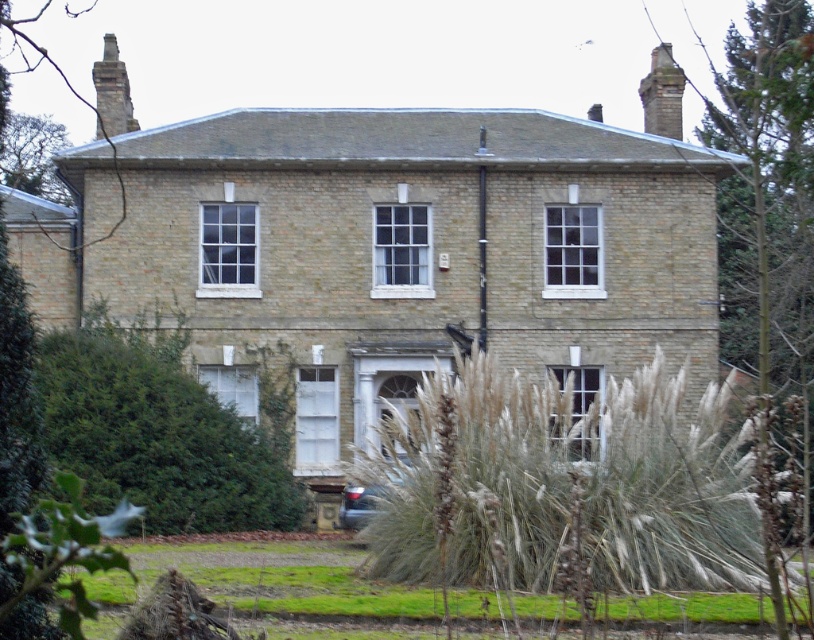
Question: In this image, where is smooth brick chimney at upper right located relative to brick chimney at upper left?

Choices:
 (A) below
 (B) above

Answer: (A)

Question: Which point is closer to the camera taking this photo?

Choices:
 (A) (642, 102)
 (B) (355, 499)
 (C) (104, 109)

Answer: (B)

Question: Which object is farther from the camera taking this photo?

Choices:
 (A) smooth brick chimney at upper right
 (B) brick chimney at upper left
 (C) shiny metallic car at lower center

Answer: (A)

Question: Estimate the real-world distances between objects in this image. Which object is farther from the smooth brick chimney at upper right?

Choices:
 (A) shiny metallic car at lower center
 (B) brick chimney at upper left

Answer: (A)

Question: Is smooth brick chimney at upper right positioned behind shiny metallic car at lower center?

Choices:
 (A) yes
 (B) no

Answer: (A)

Question: Is the position of smooth brick chimney at upper right more distant than that of brick chimney at upper left?

Choices:
 (A) yes
 (B) no

Answer: (A)